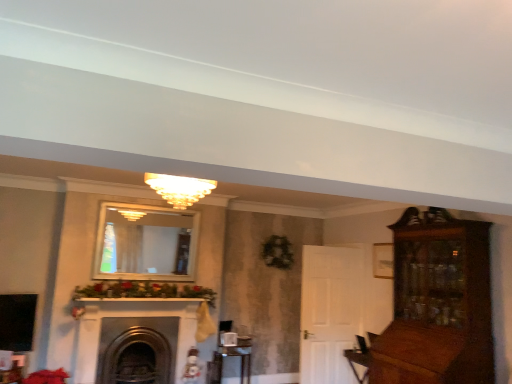
Question: Is matte glass chandelier at center at the left side of metallic silver table at lower center?

Choices:
 (A) yes
 (B) no

Answer: (A)

Question: Can you confirm if matte glass chandelier at center is taller than metallic silver table at lower center?

Choices:
 (A) yes
 (B) no

Answer: (B)

Question: Is matte glass chandelier at center outside of metallic silver table at lower center?

Choices:
 (A) no
 (B) yes

Answer: (B)

Question: Is matte glass chandelier at center wider than metallic silver table at lower center?

Choices:
 (A) yes
 (B) no

Answer: (A)

Question: Considering the relative sizes of matte glass chandelier at center and metallic silver table at lower center in the image provided, is matte glass chandelier at center thinner than metallic silver table at lower center?

Choices:
 (A) no
 (B) yes

Answer: (A)

Question: Considering the relative positions of matte glass chandelier at center and metallic silver table at lower center in the image provided, is matte glass chandelier at center to the right of metallic silver table at lower center from the viewer's perspective?

Choices:
 (A) no
 (B) yes

Answer: (A)

Question: From the image's perspective, is metallic silver table at lower center located beneath matte glass chandelier at center?

Choices:
 (A) no
 (B) yes

Answer: (B)

Question: Is metallic silver table at lower center further to the viewer compared to matte glass chandelier at center?

Choices:
 (A) yes
 (B) no

Answer: (A)

Question: Is metallic silver table at lower center thinner than matte glass chandelier at center?

Choices:
 (A) yes
 (B) no

Answer: (A)

Question: Can we say metallic silver table at lower center lies outside matte glass chandelier at center?

Choices:
 (A) yes
 (B) no

Answer: (A)

Question: From a real-world perspective, is metallic silver table at lower center beneath matte glass chandelier at center?

Choices:
 (A) no
 (B) yes

Answer: (B)

Question: From a real-world perspective, does metallic silver table at lower center stand above matte glass chandelier at center?

Choices:
 (A) no
 (B) yes

Answer: (A)

Question: Does dark gray stone fireplace at center have a lesser width compared to metallic silver table at lower center?

Choices:
 (A) yes
 (B) no

Answer: (B)